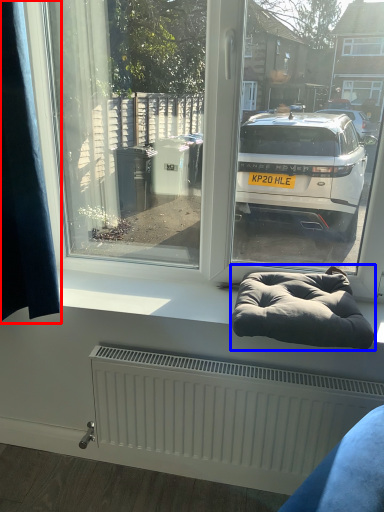
Question: Which object appears closest to the camera in this image, curtain (highlighted by a red box) or bean bag chair (highlighted by a blue box)?

Choices:
 (A) curtain
 (B) bean bag chair

Answer: (A)